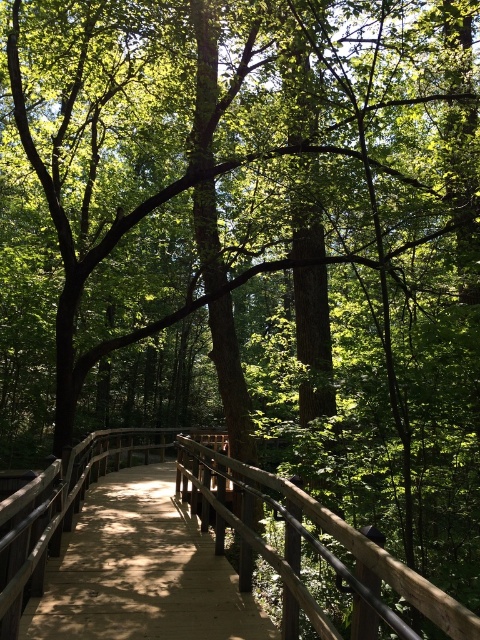
Which is below, wooden bridge at center or brown wooden bridge at center?

brown wooden bridge at center is below.

Between point (86, 598) and point (277, 556), which one is positioned behind?

The point (86, 598) is more distant.

Where is `wooden bridge at center`? The height and width of the screenshot is (640, 480). wooden bridge at center is located at coordinates (141, 572).